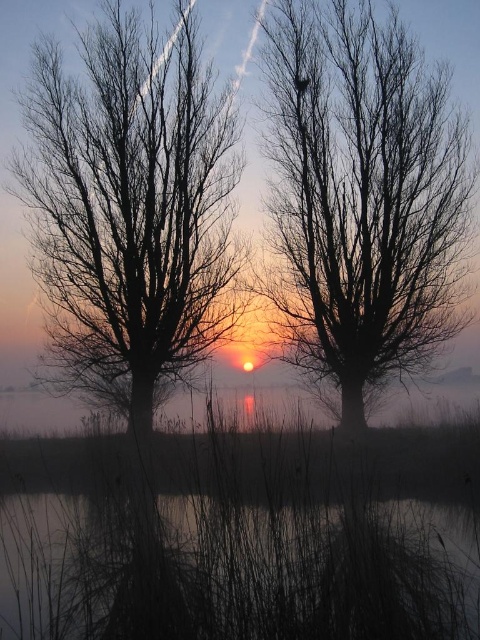
Which of these two, black matte tree at left or dark matte water at lower center, stands taller?

With more height is dark matte water at lower center.

Does black matte tree at left appear on the right side of dark matte water at lower center?

No, black matte tree at left is not to the right of dark matte water at lower center.

Is point (99, 358) in front of point (249, 563)?

No.

Find the location of a particular element. black matte tree at left is located at coordinates (132, 204).

Does black matte tree at center have a smaller size compared to black matte tree at left?

Actually, black matte tree at center might be larger than black matte tree at left.

Is point (275, 102) farther from camera compared to point (96, 35)?

Yes, point (275, 102) is farther from viewer.

Where is `black matte tree at center`? black matte tree at center is located at coordinates (361, 196).

I want to click on black matte tree at center, so click(x=361, y=196).

Looking at this image, which is more to the right, black matte tree at center or dark matte water at lower center?

Positioned to the right is black matte tree at center.

Is black matte tree at center positioned at the back of dark matte water at lower center?

Yes, black matte tree at center is further from the viewer.

Identify the location of black matte tree at center. The width and height of the screenshot is (480, 640). (361, 196).